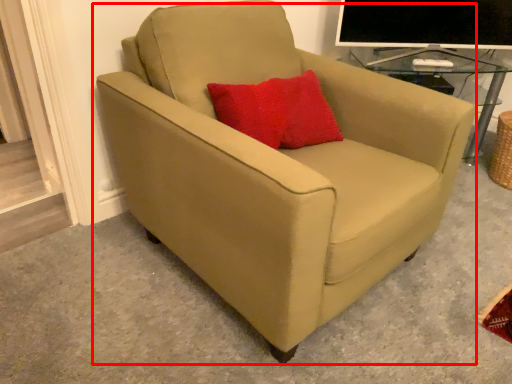
Question: Where is chair (annotated by the red box) located in relation to computer monitor in the image?

Choices:
 (A) right
 (B) left

Answer: (B)